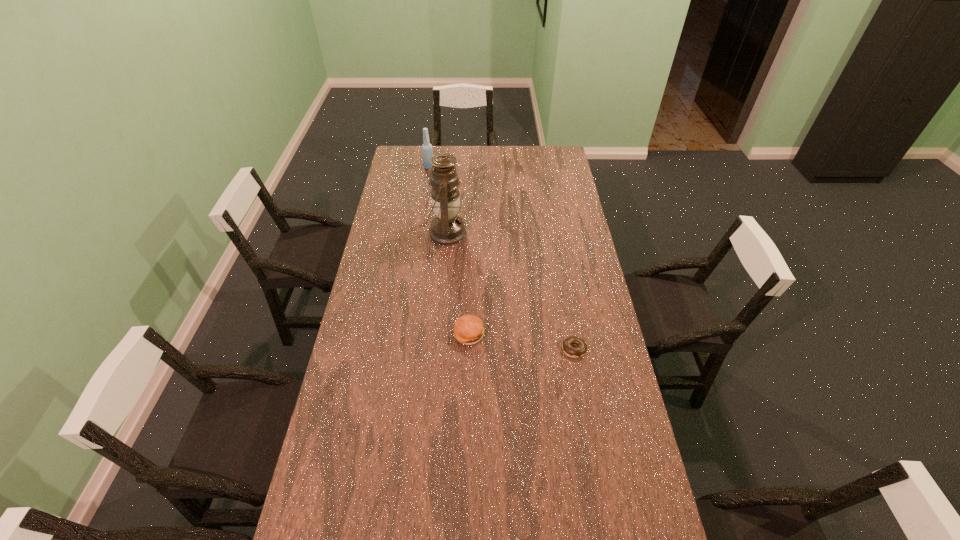
Identify the location of the tallest object. The image size is (960, 540). (447, 228).

Find the location of a particular element. the fourth nearest object is located at coordinates (447, 228).

Find the location of a particular element. This screenshot has height=540, width=960. the farthest object is located at coordinates (427, 152).

You are a GUI agent. You are given a task and a screenshot of the screen. Output one action in this format:
    pyautogui.click(x=<x>, y=<y>)
    Task: Click on the second tallest object
    
    Given the screenshot: What is the action you would take?
    point(427,152)

Where is `hamburger`? hamburger is located at coordinates (468, 329).

Image resolution: width=960 pixels, height=540 pixels. In order to click on the fourth tallest object in this screenshot , I will do `click(574, 352)`.

Where is `the rightmost object`? The height and width of the screenshot is (540, 960). the rightmost object is located at coordinates (574, 352).

The height and width of the screenshot is (540, 960). I want to click on vacant space positioned 0.140m on the front of the tallest object, so click(x=443, y=276).

At what (x,y) coordinates should I click in order to perform the action: click on vacant space positioned on the right of the bottle. Please return your answer as a coordinate pair (x, y). Looking at the image, I should click on (445, 167).

This screenshot has width=960, height=540. I want to click on vacant space located on the front of the hamburger, so click(x=468, y=388).